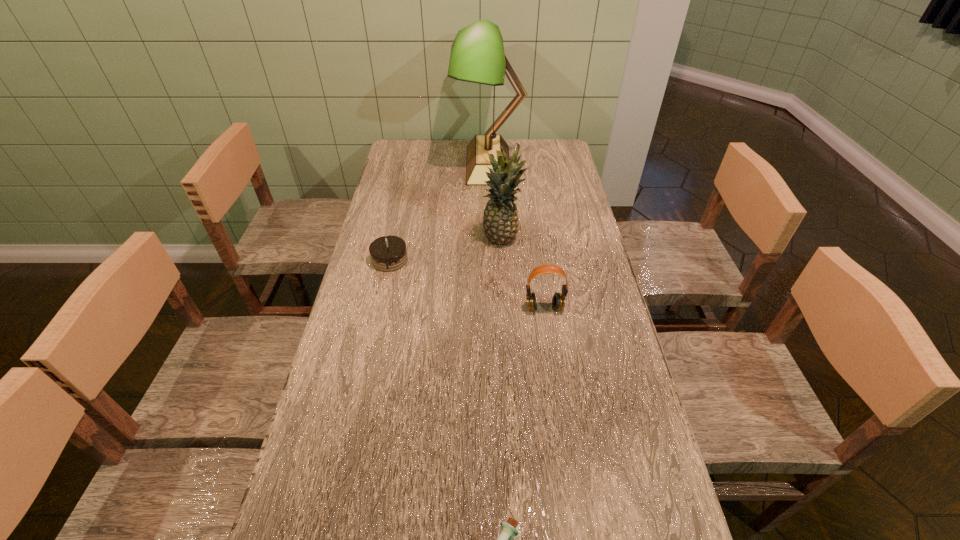
You are a GUI agent. You are given a task and a screenshot of the screen. Output one action in this format:
    pyautogui.click(x=<x>, y=<y>)
    Task: Click on the tallest object
    The height and width of the screenshot is (540, 960).
    Given the screenshot: What is the action you would take?
    pyautogui.click(x=477, y=55)

Where is `the farthest object`? This screenshot has width=960, height=540. the farthest object is located at coordinates tap(477, 55).

Find the location of a particular element. The width and height of the screenshot is (960, 540). pineapple is located at coordinates (500, 221).

I want to click on the fourth farthest object, so click(558, 301).

Locate an element on the screen. This screenshot has height=540, width=960. headset is located at coordinates point(558,301).

This screenshot has height=540, width=960. Find the location of `chocolate cake`. chocolate cake is located at coordinates (388, 253).

This screenshot has width=960, height=540. In order to click on vacant space located on the metallic stand of the farthest object in this screenshot , I will do pos(408,164).

Where is `vacant region located 0.070m on the metallic stand of the farthest object`? vacant region located 0.070m on the metallic stand of the farthest object is located at coordinates (438, 164).

Where is `free space located on the metallic stand of the farthest object`? The width and height of the screenshot is (960, 540). free space located on the metallic stand of the farthest object is located at coordinates (422, 164).

The width and height of the screenshot is (960, 540). Find the location of `free space located on the front of the pineapple`. free space located on the front of the pineapple is located at coordinates coord(507,313).